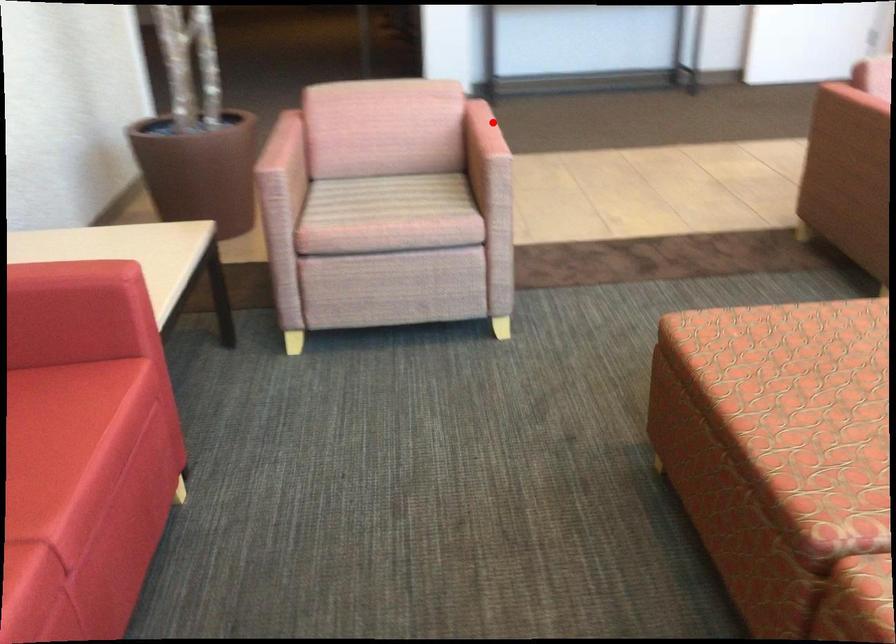
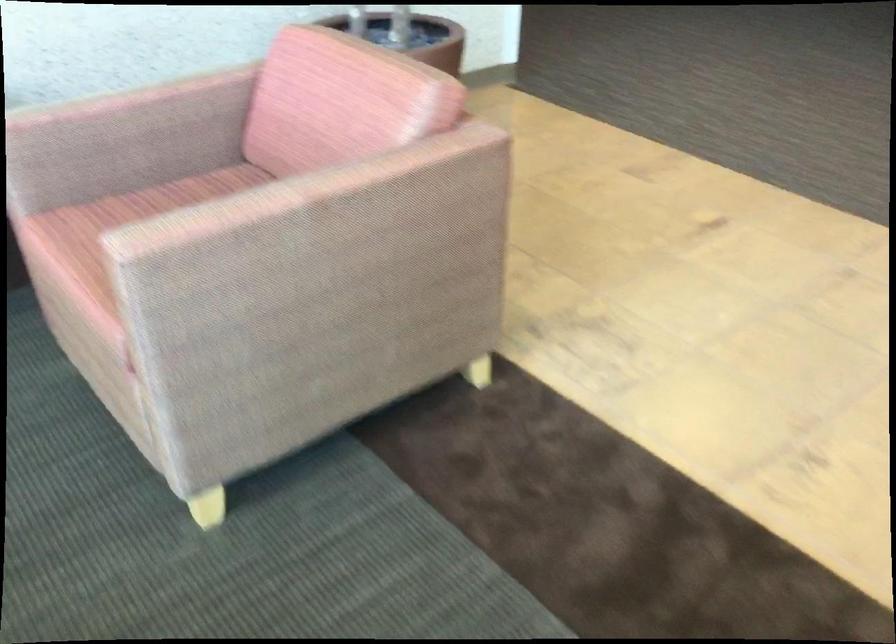
Where in the second image is the point corresponding to the highlighted location from the first image?

(298, 192)